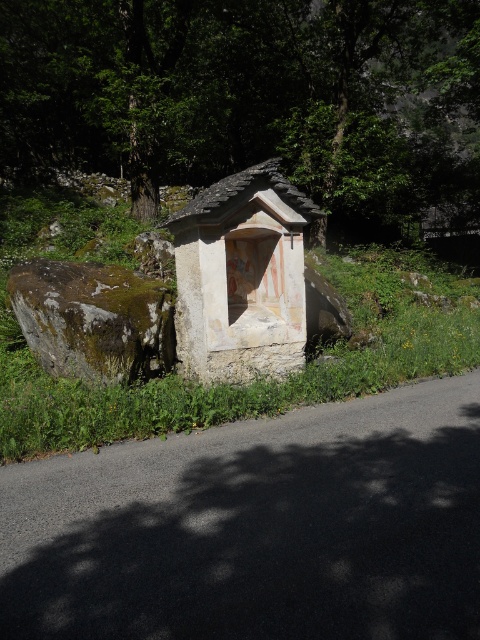
Measure the distance from green leafy tree at upper center to green mossy rock at left.

Answer: A distance of 37.09 feet exists between green leafy tree at upper center and green mossy rock at left.

The image size is (480, 640). I want to click on green leafy tree at upper center, so click(x=249, y=96).

What do you see at coordinates (249, 96) in the screenshot? I see `green leafy tree at upper center` at bounding box center [249, 96].

I want to click on green leafy tree at upper center, so click(249, 96).

From the picture: Which is below, stone wall at center or green mossy rock at left?

green mossy rock at left is below.

Between point (233, 259) and point (153, 353), which one is positioned in front?

Point (153, 353) is more forward.

What are the coordinates of `stone wall at center` in the screenshot? It's located at (193, 380).

This screenshot has width=480, height=640. What do you see at coordinates (249, 96) in the screenshot? I see `green leafy tree at upper center` at bounding box center [249, 96].

Where is `green leafy tree at upper center`? The width and height of the screenshot is (480, 640). green leafy tree at upper center is located at coordinates (249, 96).

Where is `green leafy tree at upper center`? Image resolution: width=480 pixels, height=640 pixels. green leafy tree at upper center is located at coordinates (249, 96).